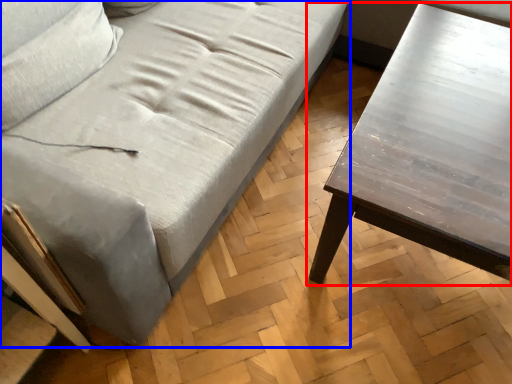
Question: Among these objects, which one is farthest to the camera, table (highlighted by a red box) or studio couch (highlighted by a blue box)?

Choices:
 (A) table
 (B) studio couch

Answer: (A)